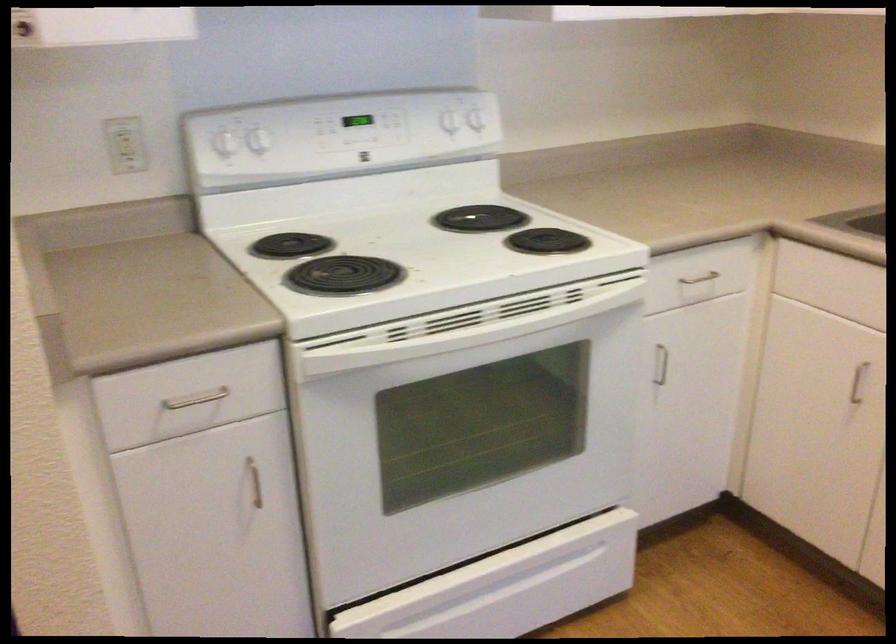
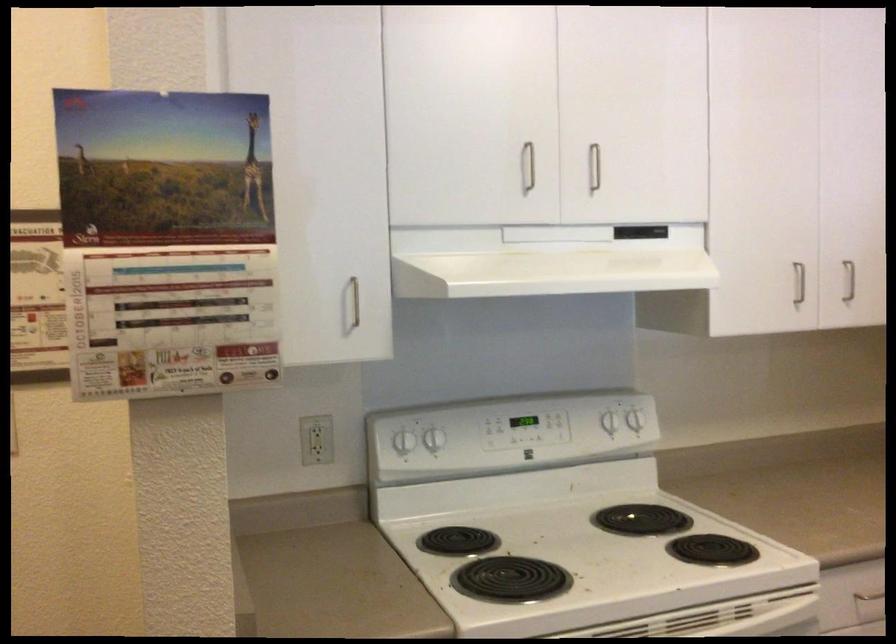
Where in the second image is the point corresponding to (451,120) from the first image?

(608, 422)